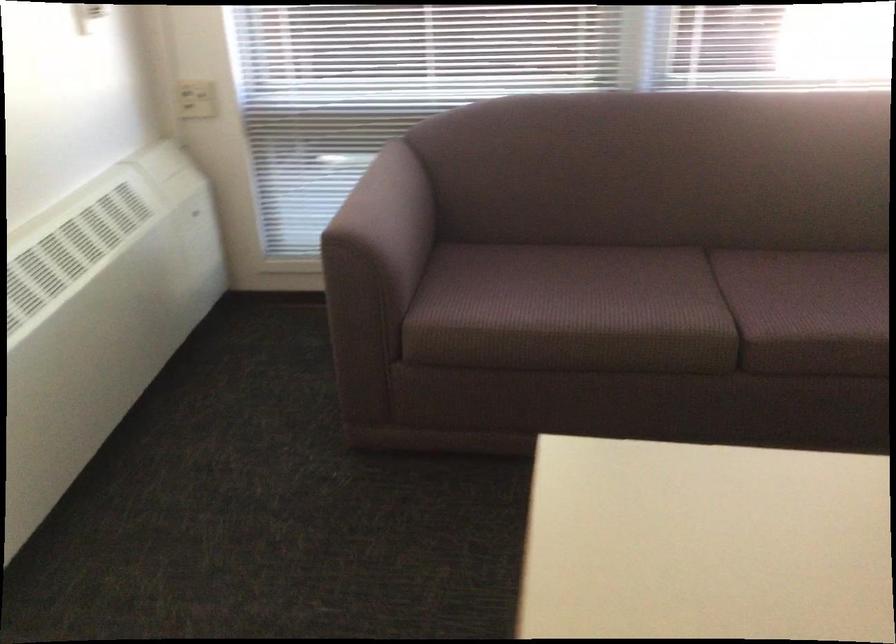
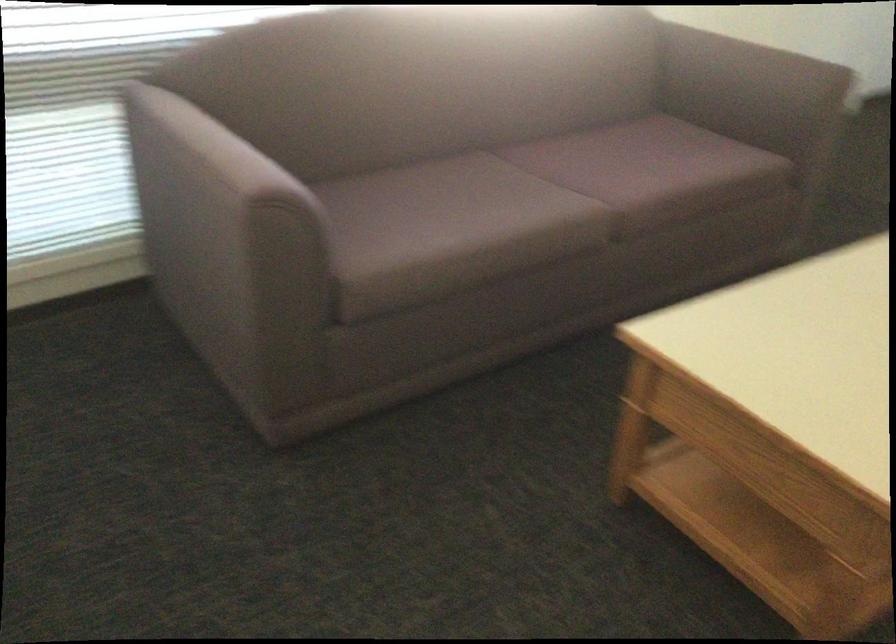
Question: Based on the continuous images, in which direction is the camera rotating? Reply with the corresponding letter.

Choices:
 (A) Left
 (B) Right
 (C) Up
 (D) Down

Answer: (B)